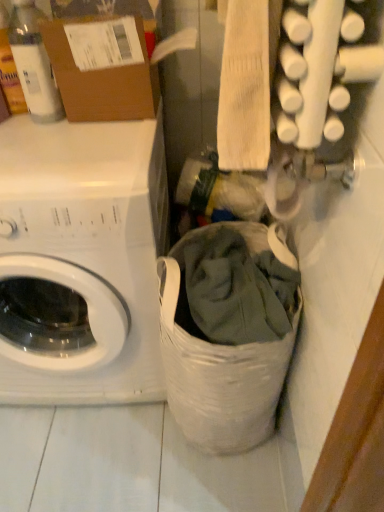
Identify the location of vacant area that is situated to the right of translucent plastic bottle at upper left. The width and height of the screenshot is (384, 512). (106, 127).